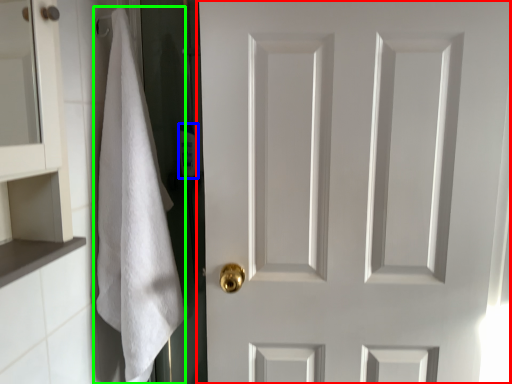
Question: Based on their relative distances, which object is farther from door (highlighted by a red box)? Choose from toiletry (highlighted by a blue box) and bath towel (highlighted by a green box).

Choices:
 (A) toiletry
 (B) bath towel

Answer: (A)